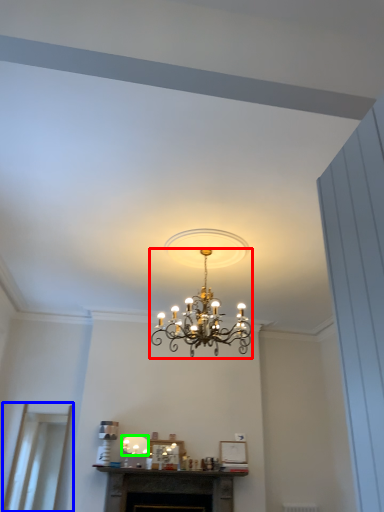
Question: Considering the real-world distances, which object is closest to lamp (highlighted by a red box)? glass door (highlighted by a blue box) or lamp (highlighted by a green box).

Choices:
 (A) glass door
 (B) lamp

Answer: (B)